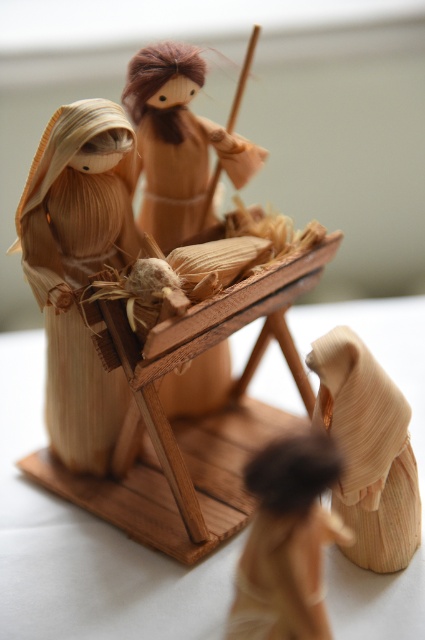
Question: Is wooden baby at center closer to camera compared to wooden shepherd at lower right?

Choices:
 (A) yes
 (B) no

Answer: (B)

Question: Which object is farther from the camera taking this photo?

Choices:
 (A) natural straw figure at left
 (B) wooden shepherd at lower right
 (C) wooden baby at center

Answer: (A)

Question: Which point is closer to the camera?

Choices:
 (A) (269, 464)
 (B) (234, 140)
 (C) (101, 104)
 (D) (380, 392)

Answer: (A)

Question: Which object appears closest to the camera in this image?

Choices:
 (A) natural straw figure at left
 (B) wooden figure at center

Answer: (A)

Question: Does wooden baby at center appear on the left side of wooden figure at center?

Choices:
 (A) yes
 (B) no

Answer: (B)

Question: In this image, where is wooden baby at center located relative to wooden figure at center?

Choices:
 (A) above
 (B) below

Answer: (B)